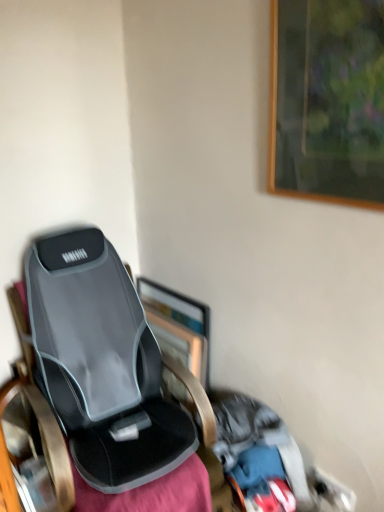
At what (x,y) coordinates should I click in order to perform the action: click on metallic silver picture frame at center, which is the first picture frame from back to front. Please return your answer as a coordinate pair (x, y). This screenshot has width=384, height=512. Looking at the image, I should click on (178, 325).

What do you see at coordinates (178, 325) in the screenshot?
I see `metallic silver picture frame at center, the first picture frame viewed from the left` at bounding box center [178, 325].

I want to click on wooden picture frame at upper right, which ranks as the 1th picture frame in right-to-left order, so click(327, 101).

What do you see at coordinates (327, 101) in the screenshot?
I see `wooden picture frame at upper right, the second picture frame in the back-to-front sequence` at bounding box center [327, 101].

In order to face wooden picture frame at upper right, the 2th picture frame positioned from the bottom, should I rotate leftwards or rightwards?

You should look right and rotate roughly 17.166 degrees.

This screenshot has height=512, width=384. I want to click on metallic silver picture frame at center, the first picture frame viewed from the left, so click(x=178, y=325).

Considering the relative positions of wooden picture frame at upper right, the 1th picture frame from the top, and metallic silver picture frame at center, the 2th picture frame in the front-to-back sequence, in the image provided, is wooden picture frame at upper right, the 1th picture frame from the top, to the left or to the right of metallic silver picture frame at center, the 2th picture frame in the front-to-back sequence,?

Clearly, wooden picture frame at upper right, the 1th picture frame from the top, is on the right of metallic silver picture frame at center, the 2th picture frame in the front-to-back sequence, in the image.

Which is behind, wooden picture frame at upper right, acting as the first picture frame starting from the front, or metallic silver picture frame at center, acting as the second picture frame starting from the top?

metallic silver picture frame at center, acting as the second picture frame starting from the top, is more distant.

Which is more distant, [325,199] or [176,293]?

Point [176,293]

From the image's perspective, which one is positioned higher, wooden picture frame at upper right, the second picture frame in the back-to-front sequence, or metallic silver picture frame at center, the 2th picture frame in the right-to-left sequence?

wooden picture frame at upper right, the second picture frame in the back-to-front sequence, appears higher in the image.

Based on the photo, from a real-world perspective, is wooden picture frame at upper right, which is counted as the 2th picture frame, starting from the left, physically located above or below metallic silver picture frame at center, the first picture frame viewed from the left?

Clearly, from a real-world perspective, wooden picture frame at upper right, which is counted as the 2th picture frame, starting from the left, is above metallic silver picture frame at center, the first picture frame viewed from the left.

Is wooden picture frame at upper right, the 1th picture frame from the top, wider or thinner than metallic silver picture frame at center, which is the first picture frame from back to front?

In the image, wooden picture frame at upper right, the 1th picture frame from the top, appears to be more narrow than metallic silver picture frame at center, which is the first picture frame from back to front.

Considering the sizes of wooden picture frame at upper right, acting as the first picture frame starting from the front, and metallic silver picture frame at center, acting as the second picture frame starting from the top, in the image, is wooden picture frame at upper right, acting as the first picture frame starting from the front, taller or shorter than metallic silver picture frame at center, acting as the second picture frame starting from the top,?

Clearly, wooden picture frame at upper right, acting as the first picture frame starting from the front, is taller compared to metallic silver picture frame at center, acting as the second picture frame starting from the top.

Looking at this image, does wooden picture frame at upper right, the second picture frame in the back-to-front sequence, have a larger size compared to metallic silver picture frame at center, the first picture frame viewed from the left?

Actually, wooden picture frame at upper right, the second picture frame in the back-to-front sequence, might be smaller than metallic silver picture frame at center, the first picture frame viewed from the left.

Is metallic silver picture frame at center, the 2th picture frame in the front-to-back sequence, completely or partially inside wooden picture frame at upper right, the 1th picture frame from the top?

No, metallic silver picture frame at center, the 2th picture frame in the front-to-back sequence, is located outside of wooden picture frame at upper right, the 1th picture frame from the top.

Is wooden picture frame at upper right, the second picture frame in the back-to-front sequence, next to metallic silver picture frame at center, which is the first picture frame from back to front, and touching it?

There is a gap between wooden picture frame at upper right, the second picture frame in the back-to-front sequence, and metallic silver picture frame at center, which is the first picture frame from back to front.

Is wooden picture frame at upper right, the 2th picture frame positioned from the bottom, positioned with its back to metallic silver picture frame at center, acting as the second picture frame starting from the top?

wooden picture frame at upper right, the 2th picture frame positioned from the bottom, is not turned away from metallic silver picture frame at center, acting as the second picture frame starting from the top.

How different are the orientations of wooden picture frame at upper right, the 2th picture frame positioned from the bottom, and metallic silver picture frame at center, acting as the second picture frame starting from the top, in degrees?

The angle between the facing direction of wooden picture frame at upper right, the 2th picture frame positioned from the bottom, and the facing direction of metallic silver picture frame at center, acting as the second picture frame starting from the top, is 89.4 degrees.

This screenshot has height=512, width=384. In order to click on picture frame above the metallic silver picture frame at center, the first picture frame viewed from the left (from a real-world perspective) in this screenshot , I will do `click(327, 101)`.

Which is more to the left, metallic silver picture frame at center, acting as the second picture frame starting from the top, or wooden picture frame at upper right, the 2th picture frame positioned from the bottom?

From the viewer's perspective, metallic silver picture frame at center, acting as the second picture frame starting from the top, appears more on the left side.

Is the depth of metallic silver picture frame at center, which is counted as the first picture frame, starting from the bottom, greater than that of wooden picture frame at upper right, which ranks as the 1th picture frame in right-to-left order?

Yes, metallic silver picture frame at center, which is counted as the first picture frame, starting from the bottom, is further from the viewer.

Does point (185, 304) lie behind point (345, 23)?

Yes, it is behind point (345, 23).

From the image's perspective, is metallic silver picture frame at center, which is the first picture frame from back to front, located above wooden picture frame at upper right, the second picture frame in the back-to-front sequence?

Incorrect, from the image's perspective, metallic silver picture frame at center, which is the first picture frame from back to front, is lower than wooden picture frame at upper right, the second picture frame in the back-to-front sequence.

Based on the photo, from a real-world perspective, is metallic silver picture frame at center, the 2th picture frame in the right-to-left sequence, positioned above or below wooden picture frame at upper right, the second picture frame in the back-to-front sequence?

From a real-world perspective, metallic silver picture frame at center, the 2th picture frame in the right-to-left sequence, is physically below wooden picture frame at upper right, the second picture frame in the back-to-front sequence.

Which object is wider, metallic silver picture frame at center, the 2th picture frame in the front-to-back sequence, or wooden picture frame at upper right, the second picture frame in the back-to-front sequence?

metallic silver picture frame at center, the 2th picture frame in the front-to-back sequence, is wider.

Which of these two, metallic silver picture frame at center, which is counted as the first picture frame, starting from the bottom, or wooden picture frame at upper right, acting as the first picture frame starting from the front, stands taller?

wooden picture frame at upper right, acting as the first picture frame starting from the front, is taller.

Can you confirm if metallic silver picture frame at center, the first picture frame viewed from the left, is bigger than wooden picture frame at upper right, the second picture frame in the back-to-front sequence?

Indeed, metallic silver picture frame at center, the first picture frame viewed from the left, has a larger size compared to wooden picture frame at upper right, the second picture frame in the back-to-front sequence.

Is wooden picture frame at upper right, acting as the first picture frame starting from the front, surrounded by metallic silver picture frame at center, the 2th picture frame in the right-to-left sequence?

No, wooden picture frame at upper right, acting as the first picture frame starting from the front, is not a part of metallic silver picture frame at center, the 2th picture frame in the right-to-left sequence.

Are metallic silver picture frame at center, the 2th picture frame in the front-to-back sequence, and wooden picture frame at upper right, acting as the first picture frame starting from the front, located far from each other?

metallic silver picture frame at center, the 2th picture frame in the front-to-back sequence, is actually quite close to wooden picture frame at upper right, acting as the first picture frame starting from the front.

Based on the photo, could you tell me if metallic silver picture frame at center, the 2th picture frame in the right-to-left sequence, is facing wooden picture frame at upper right, acting as the first picture frame starting from the front?

No, metallic silver picture frame at center, the 2th picture frame in the right-to-left sequence, does not turn towards wooden picture frame at upper right, acting as the first picture frame starting from the front.

What's the angular difference between metallic silver picture frame at center, the first picture frame viewed from the left, and wooden picture frame at upper right, the second picture frame in the back-to-front sequence,'s facing directions?

metallic silver picture frame at center, the first picture frame viewed from the left, and wooden picture frame at upper right, the second picture frame in the back-to-front sequence, are facing 89.4 degrees away from each other.

Where is `picture frame below the wooden picture frame at upper right, which ranks as the 1th picture frame in right-to-left order (from the image's perspective)`? This screenshot has height=512, width=384. picture frame below the wooden picture frame at upper right, which ranks as the 1th picture frame in right-to-left order (from the image's perspective) is located at coordinates (178, 325).

This screenshot has height=512, width=384. I want to click on picture frame that appears below the wooden picture frame at upper right, the 2th picture frame positioned from the bottom (from the image's perspective), so click(178, 325).

I want to click on picture frame that appears on the left of wooden picture frame at upper right, which is counted as the 2th picture frame, starting from the left, so click(178, 325).